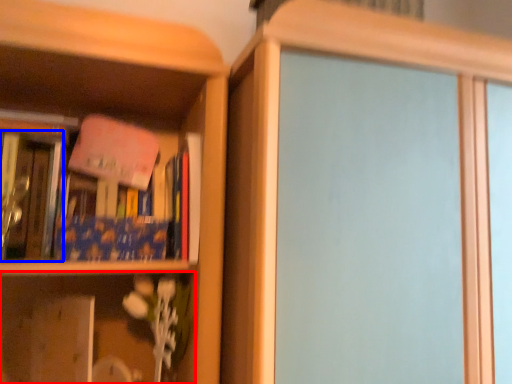
Question: Which object is closer to the camera taking this photo, shelf (highlighted by a red box) or book (highlighted by a blue box)?

Choices:
 (A) shelf
 (B) book

Answer: (A)